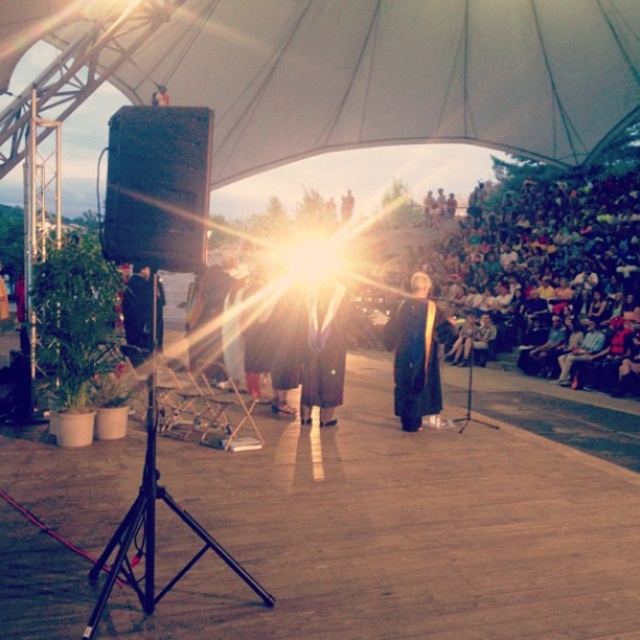
You are attending an outdoor event under a large white tent and notice two gowns at the center of the stage. The first is labeled as a black matte gown at center, and the second is labeled as a matte black gown at center. Which of these gowns is bigger in size?

The black matte gown at center is larger in size than the matte black gown at center.

You are standing at the camera position and want to walk to the wooden stage at center. How many steps would you need to take if each step covers approximately 2 feet?

The wooden stage at center is 13.06 feet away from the camera. Since each step covers about 2 feet, you would need approximately 7 steps to reach the wooden stage at center.

You are standing at the center of the stage and want to move towards the nearest point between point (406, 332) and point (339, 381). Which point should you walk towards?

Point (406, 332) is closer to the viewer than point (339, 381), so you should walk towards point (406, 332).